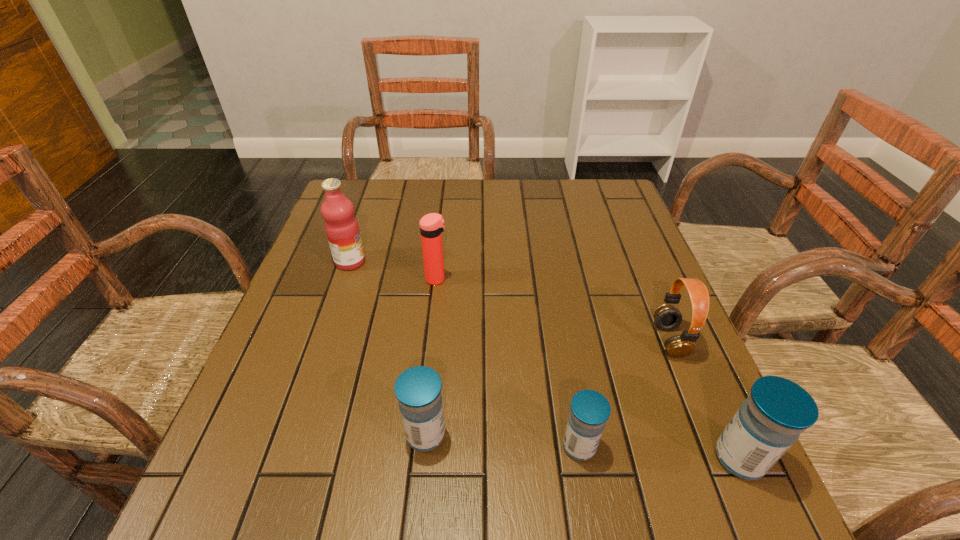
This screenshot has width=960, height=540. What are the coordinates of `free space that satisfies the following two spatial constraints: 1. on the label of the fifth nearest object; 2. on the left side of the fruit juice` in the screenshot? It's located at (345, 279).

You are a GUI agent. You are given a task and a screenshot of the screen. Output one action in this format:
    pyautogui.click(x=<x>, y=<y>)
    Task: Click on the vacant region that satisfies the following two spatial constraints: 1. on the front side of the thermos bottle; 2. on the right side of the shortest object
    Image resolution: width=960 pixels, height=540 pixels.
    Given the screenshot: What is the action you would take?
    pyautogui.click(x=419, y=446)

The width and height of the screenshot is (960, 540). Identify the location of vacant space that satisfies the following two spatial constraints: 1. on the label of the tallest object; 2. on the back side of the leftmost medicine. (292, 435).